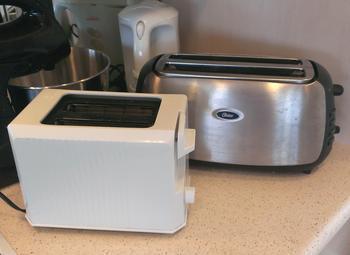
Image resolution: width=350 pixels, height=255 pixels. In order to click on counter top in this screenshot , I will do `click(313, 224)`.